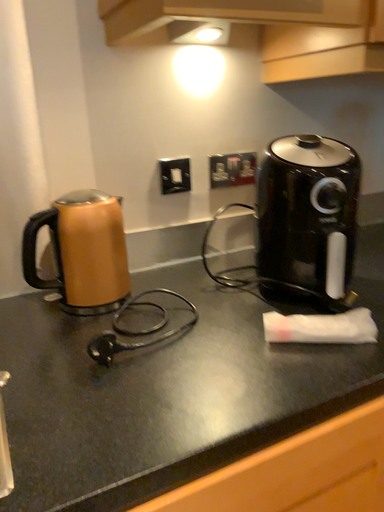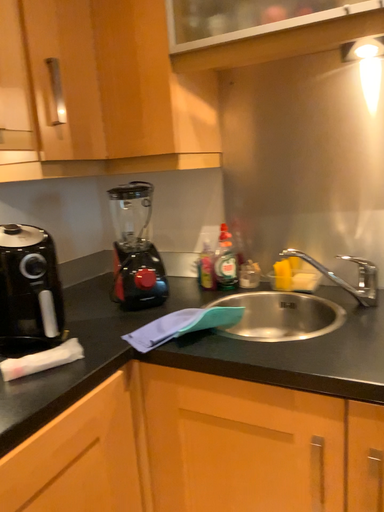
Question: Which way did the camera rotate in the video?

Choices:
 (A) rotated upward
 (B) rotated downward

Answer: (A)